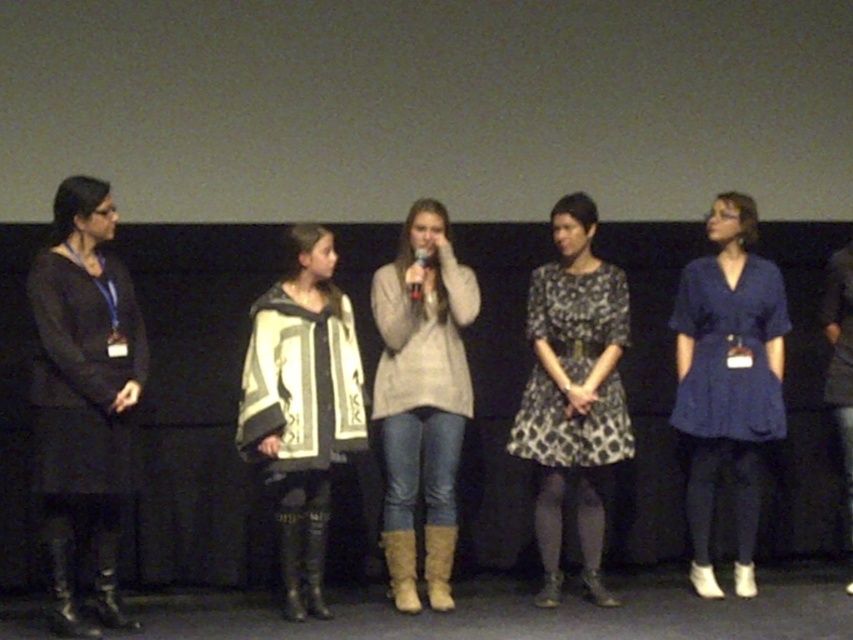
Based on the scene description, which individual is taller between the matte black dress at left and the white and black patterned poncho at center?

The matte black dress at left is much taller than the white and black patterned poncho at center.

You are a photographer who needs to capture a photo of the white and black patterned poncho at center and the printed fabric dress at center. Which one should you focus on first if you want to capture the one closer to the left side?

The white and black patterned poncho at center is to the left of the printed fabric dress at center, so you should focus on the white and black patterned poncho at center first.

You are standing in the audience and see the point at coordinates (302, 406) on the stage. Which individual is wearing a white and black patterned poncho at center?

The point at coordinates (302, 406) is on the white and black patterned poncho at center, so the individual wearing it is the second from the left.